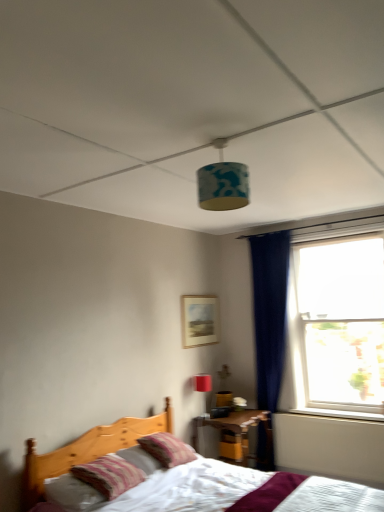
Question: In terms of width, does transparent glass window at right look wider or thinner when compared to matte red table lamp at upper center?

Choices:
 (A) thin
 (B) wide

Answer: (B)

Question: Considering the positions of transparent glass window at right and matte red table lamp at upper center in the image, is transparent glass window at right taller or shorter than matte red table lamp at upper center?

Choices:
 (A) tall
 (B) short

Answer: (A)

Question: Which object is positioned farthest from the matte red table lamp at upper center?

Choices:
 (A) transparent glass window at right
 (B) wooden nightstand at lower center
 (C) striped fabric pillow at lower left, acting as the 1th pillow starting from the front
 (D) matte wooden picture frame at center
 (E) white plastic window sill at lower right

Answer: (C)

Question: Which of these objects is positioned farthest from the striped fabric pillow at lower left, acting as the 1th pillow starting from the front?

Choices:
 (A) matte wooden picture frame at center
 (B) striped fabric pillow at center, arranged as the 1th pillow when viewed from the back
 (C) blue fabric lampshade at center
 (D) white plastic window sill at lower right
 (E) wooden nightstand at lower center

Answer: (D)